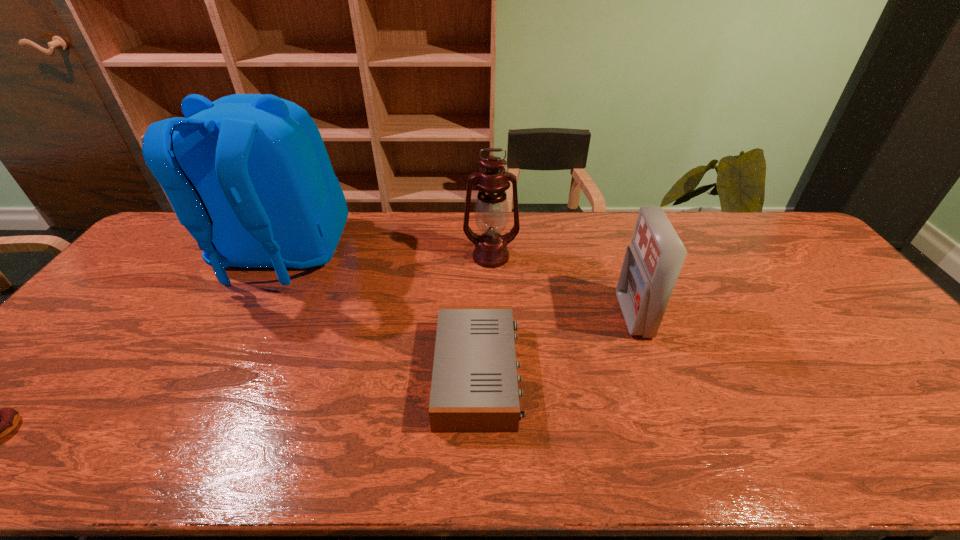
Where is `vacant space located 0.090m on the front-facing side of the third tallest object`? This screenshot has height=540, width=960. vacant space located 0.090m on the front-facing side of the third tallest object is located at coordinates (x=589, y=315).

Find the location of a particular element. The image size is (960, 540). vacant space located on the front panel of the radio receiver is located at coordinates (626, 373).

The height and width of the screenshot is (540, 960). Identify the location of backpack situated at the far edge. (248, 175).

Find the location of a particular element. The height and width of the screenshot is (540, 960). oil lamp that is at the far edge is located at coordinates (491, 211).

The height and width of the screenshot is (540, 960). I want to click on object that is at the near edge, so click(x=474, y=388).

At what (x,y) coordinates should I click in order to perform the action: click on free space at the far edge. Please return your answer as a coordinate pair (x, y). The width and height of the screenshot is (960, 540). Looking at the image, I should click on (722, 235).

The width and height of the screenshot is (960, 540). I want to click on vacant space at the near edge of the desktop, so click(x=714, y=443).

You are a GUI agent. You are given a task and a screenshot of the screen. Output one action in this format:
    pyautogui.click(x=<x>, y=<y>)
    Task: Click on the free spot at the right edge of the desktop
    
    Given the screenshot: What is the action you would take?
    pyautogui.click(x=816, y=291)

The image size is (960, 540). I want to click on free space between the first-aid kit and the radio receiver, so click(x=556, y=345).

The width and height of the screenshot is (960, 540). Find the location of `free point between the tallest object and the third shortest object`. free point between the tallest object and the third shortest object is located at coordinates (457, 286).